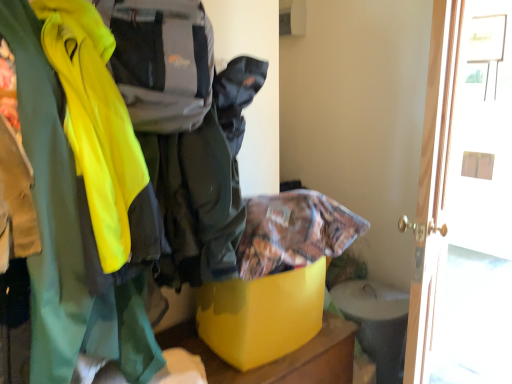
The width and height of the screenshot is (512, 384). What do you see at coordinates (261, 315) in the screenshot?
I see `yellow plastic storage box at center` at bounding box center [261, 315].

Describe the element at coordinates (294, 232) in the screenshot. Image resolution: width=512 pixels, height=384 pixels. I see `printed fabric bag at center` at that location.

You are a GUI agent. You are given a task and a screenshot of the screen. Output one action in this format:
    pyautogui.click(x=<x>, y=<y>)
    Task: Click on the white glossy door at right
    
    Given the screenshot: What is the action you would take?
    pyautogui.click(x=464, y=202)

Where is `yellow plastic storage box at center`? The image size is (512, 384). yellow plastic storage box at center is located at coordinates (261, 315).

From a real-world perspective, which is physically below, printed fabric bag at center or yellow plastic storage box at center?

yellow plastic storage box at center.

Can you confirm if printed fabric bag at center is bigger than yellow plastic storage box at center?

Incorrect, printed fabric bag at center is not larger than yellow plastic storage box at center.

Would you say printed fabric bag at center is a long distance from yellow plastic storage box at center?

No, printed fabric bag at center is in close proximity to yellow plastic storage box at center.

Who is taller, printed fabric bag at center or yellow plastic storage box at center?

With more height is yellow plastic storage box at center.

You are a GUI agent. You are given a task and a screenshot of the screen. Output one action in this format:
    pyautogui.click(x=<x>, y=<y>)
    Task: Click on the storage box lying below the printed fabric bag at center (from the image's perspective)
    
    Given the screenshot: What is the action you would take?
    pyautogui.click(x=261, y=315)

From the image's perspective, which is below, yellow plastic storage box at center or printed fabric bag at center?

yellow plastic storage box at center appears lower in the image.

Is yellow plastic storage box at center aimed at printed fabric bag at center?

No, yellow plastic storage box at center does not turn towards printed fabric bag at center.

Which object is further away from the camera taking this photo, printed fabric bag at center or white glossy door at right?

white glossy door at right is more distant.

Is printed fabric bag at center thinner than white glossy door at right?

No.

Considering the relative positions of printed fabric bag at center and white glossy door at right in the image provided, is printed fabric bag at center to the left of white glossy door at right from the viewer's perspective?

Indeed, printed fabric bag at center is positioned on the left side of white glossy door at right.

From the image's perspective, is white glossy door at right on yellow plastic storage box at center?

Indeed, from the image's perspective, white glossy door at right is shown above yellow plastic storage box at center.

Considering the positions of objects white glossy door at right and yellow plastic storage box at center in the image provided, who is more to the right, white glossy door at right or yellow plastic storage box at center?

white glossy door at right is more to the right.

Is white glossy door at right positioned far away from yellow plastic storage box at center?

Actually, white glossy door at right and yellow plastic storage box at center are a little close together.

Considering the positions of objects white glossy door at right and yellow plastic storage box at center in the image provided, who is in front, white glossy door at right or yellow plastic storage box at center?

yellow plastic storage box at center is closer to the camera.

From the image's perspective, is yellow plastic storage box at center located beneath white glossy door at right?

Indeed, from the image's perspective, yellow plastic storage box at center is shown beneath white glossy door at right.

Which object is positioned more to the left, yellow plastic storage box at center or white glossy door at right?

From the viewer's perspective, yellow plastic storage box at center appears more on the left side.

In the scene shown: Between yellow plastic storage box at center and white glossy door at right, which one has more height?

white glossy door at right is taller.

Are yellow plastic storage box at center and white glossy door at right located far from each other?

That's not correct — yellow plastic storage box at center is a little close to white glossy door at right.

From a real-world perspective, which object rests below the other?

white glossy door at right, from a real-world perspective.

Which of these two, white glossy door at right or printed fabric bag at center, is thinner?

white glossy door at right.

Is white glossy door at right turned away from printed fabric bag at center?

white glossy door at right is not turned away from printed fabric bag at center.

Identify the location of cloak in front of the yellow plastic storage box at center. (294, 232).

Identify the location of storage box below the printed fabric bag at center (from the image's perspective). The image size is (512, 384). (261, 315).

From the image, which object appears to be nearer to printed fabric bag at center, yellow plastic storage box at center or white glossy door at right?

yellow plastic storage box at center.

Based on their spatial positions, is printed fabric bag at center or white glossy door at right closer to yellow plastic storage box at center?

printed fabric bag at center lies closer to yellow plastic storage box at center than the other object.

Considering their positions, is printed fabric bag at center positioned further to white glossy door at right than yellow plastic storage box at center?

printed fabric bag at center.

When comparing their distances from white glossy door at right, does yellow plastic storage box at center or printed fabric bag at center seem further?

Among the two, printed fabric bag at center is located further to white glossy door at right.

Based on the photo, considering their positions, is white glossy door at right positioned further to yellow plastic storage box at center than printed fabric bag at center?

Among the two, white glossy door at right is located further to yellow plastic storage box at center.

Based on their spatial positions, is white glossy door at right or yellow plastic storage box at center further from printed fabric bag at center?

→ white glossy door at right lies further to printed fabric bag at center than the other object.

This screenshot has height=384, width=512. What are the coordinates of `cloak between yellow plastic storage box at center and white glossy door at right in the horizontal direction` in the screenshot? It's located at (294, 232).